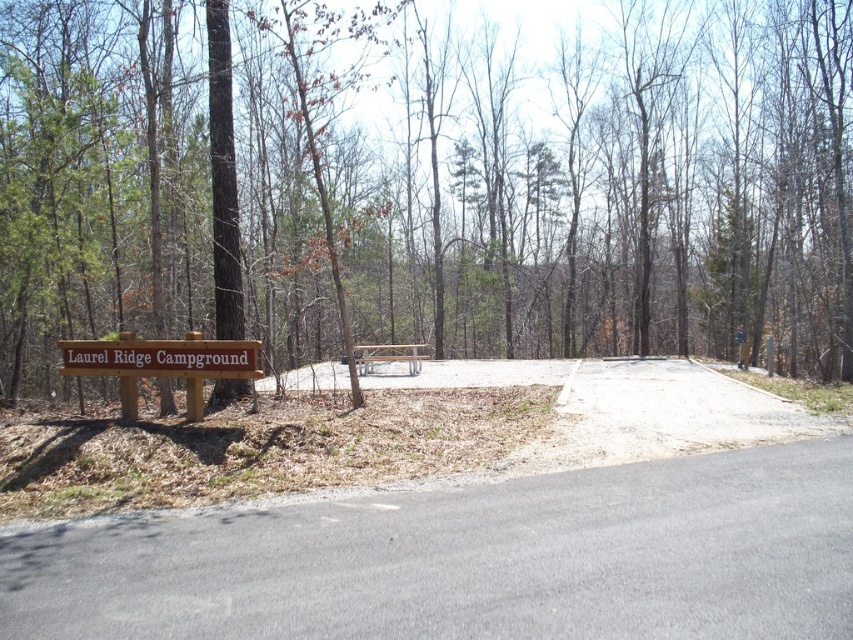
You are driving a large truck with a width of 2.5 meters. You need to pass through the gray asphalt road at lower center. Can you safely navigate the road if the brown wooden sign at lower left is nearby?

The gray asphalt road at lower center is thinner than the brown wooden sign at lower left. Since the road is narrower than the sign, it might not be wide enough for a 2.5 meter truck. Check the road width before proceeding.

You are driving a car and see the gray asphalt road at lower center and the brown wooden sign at lower left. Which object is positioned to the right of the other?

The gray asphalt road at lower center is positioned to the right of the brown wooden sign at lower left.

You are driving a car that is 1.8 meters wide. You need to pass through the space between the brown wooden sign at lower left and the brown wooden sign at center. Can your car fit through the gap between them?

The brown wooden sign at lower left is positioned under the brown wooden sign at center, which means they are vertically aligned. Since your car is 1.8 meters wide and the gap between them is vertical, the car can easily pass through horizontally as there is no horizontal obstruction.